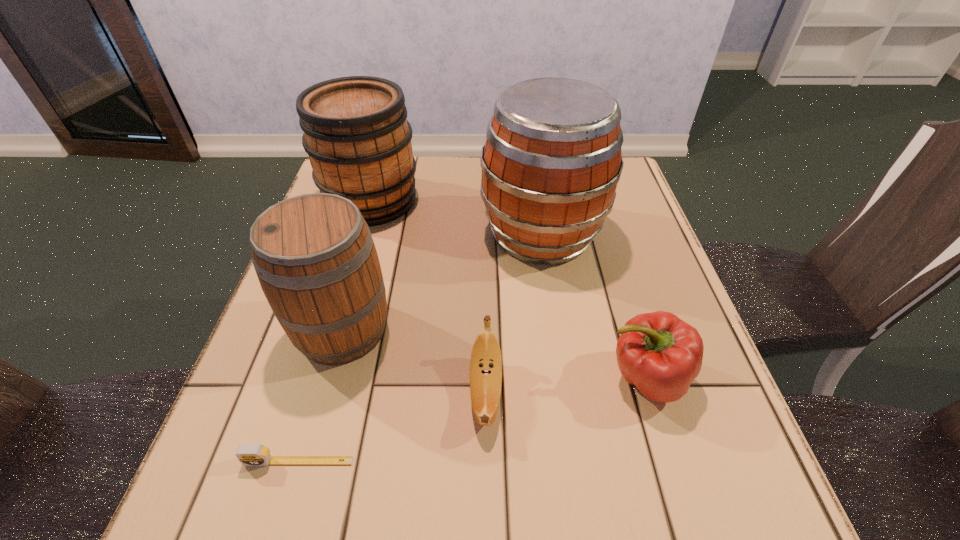
Image resolution: width=960 pixels, height=540 pixels. In order to click on the tallest cider in this screenshot , I will do `click(552, 160)`.

The image size is (960, 540). Find the location of `the rightmost cider`. the rightmost cider is located at coordinates (552, 160).

At what (x,y) coordinates should I click in order to perform the action: click on the nearest cider. Please return your answer as a coordinate pair (x, y). Image resolution: width=960 pixels, height=540 pixels. Looking at the image, I should click on (314, 255).

Locate an element on the screen. The image size is (960, 540). the fourth tallest object is located at coordinates (660, 354).

Identify the location of the second shortest object. (486, 363).

Where is `the shortest object`? the shortest object is located at coordinates (253, 454).

This screenshot has width=960, height=540. Find the location of `tape measure`. tape measure is located at coordinates (253, 454).

Find the location of a particular element. The height and width of the screenshot is (540, 960). free space located 0.320m on the front of the tallest cider is located at coordinates (569, 410).

Locate an element on the screen. This screenshot has width=960, height=540. free space located 0.110m on the front of the nearest cider is located at coordinates (314, 431).

Where is `vacant space located on the front of the third shortest object`? The image size is (960, 540). vacant space located on the front of the third shortest object is located at coordinates (675, 476).